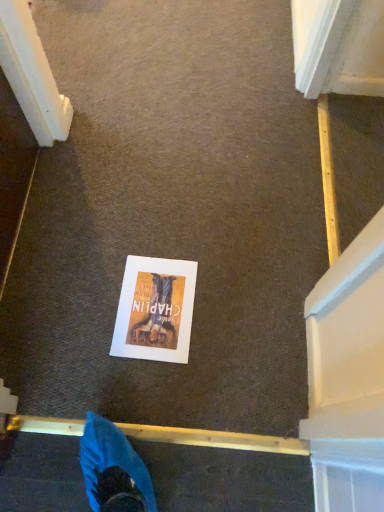
This screenshot has height=512, width=384. I want to click on free space below white paper at center (from a real-world perspective), so click(x=155, y=311).